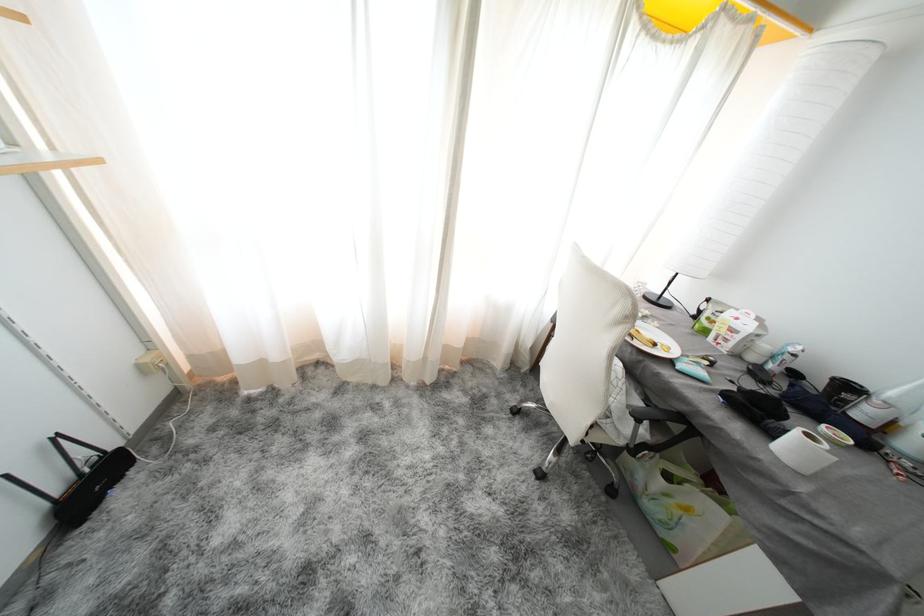
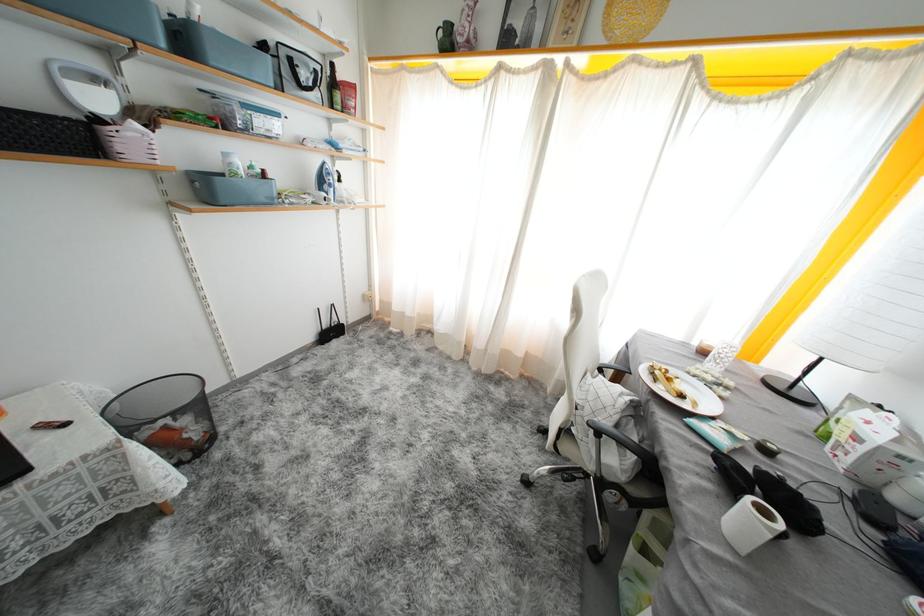
Find the pixel in the second image that matches [630,392] in the first image.

(623, 422)